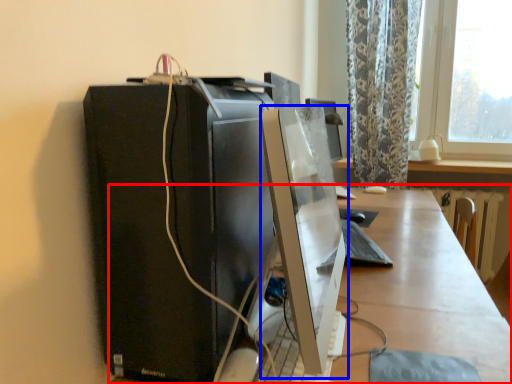
Question: Which object is closer to the camera taking this photo, desk (highlighted by a red box) or computer monitor (highlighted by a blue box)?

Choices:
 (A) desk
 (B) computer monitor

Answer: (B)